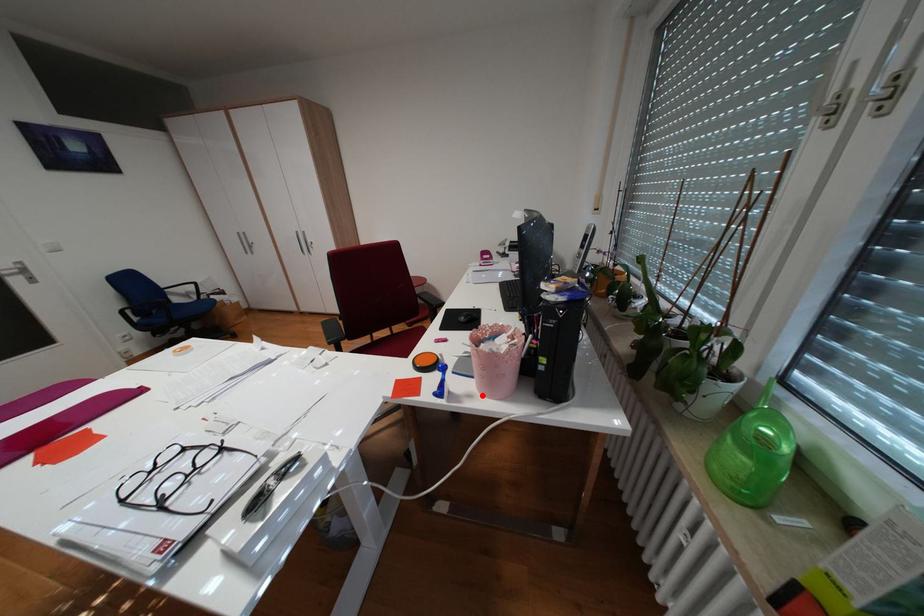
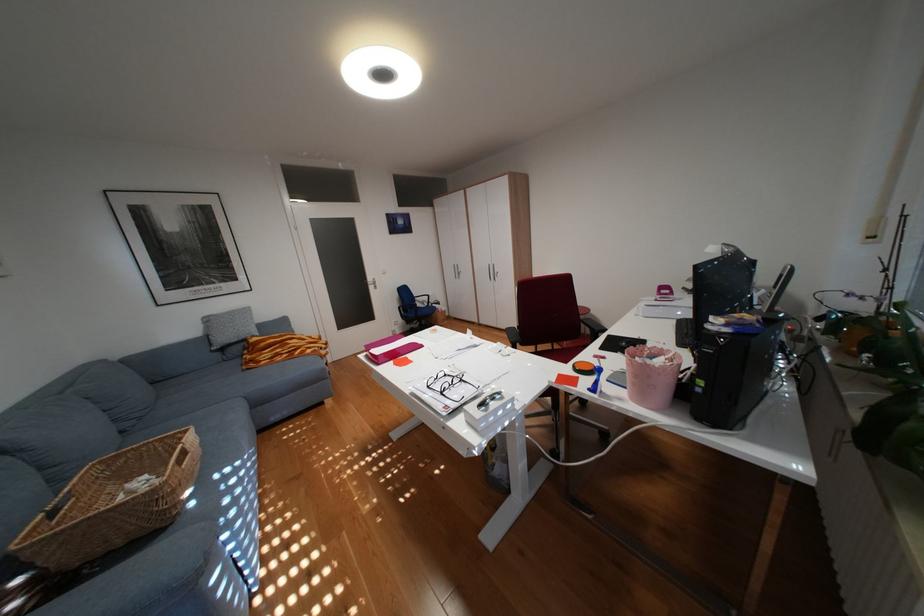
In the second image, find the point that corresponds to the highlighted location in the first image.

(633, 399)